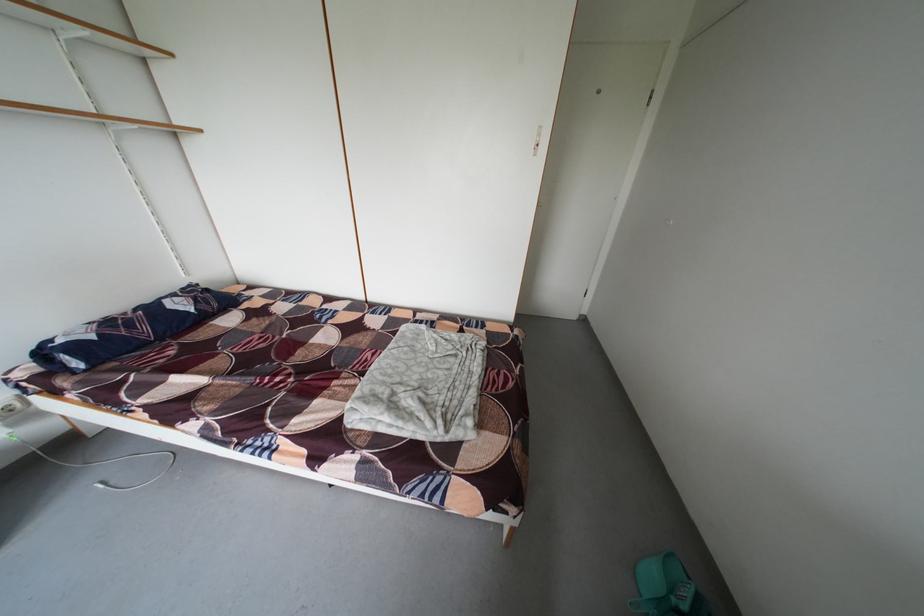
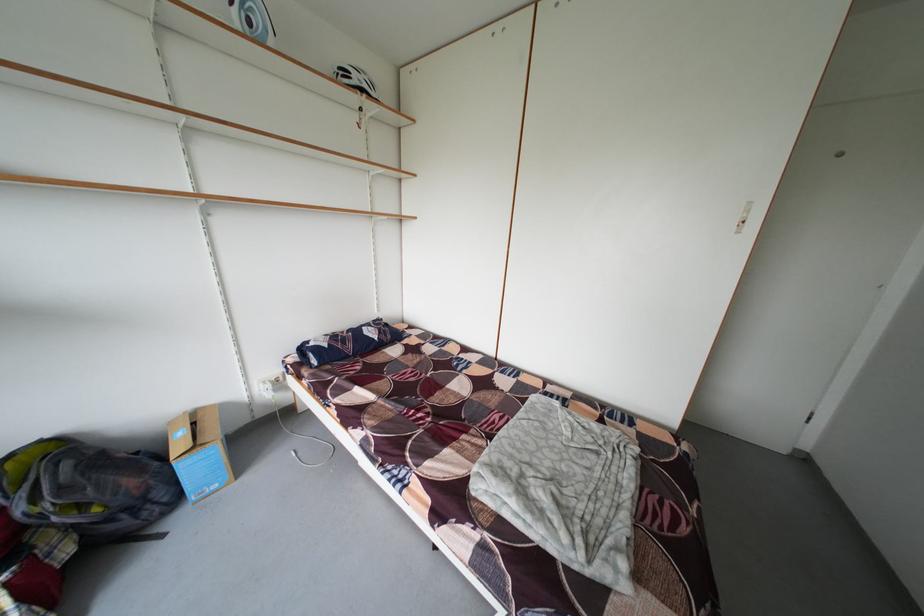
Find the pixel in the second image that matches point 380,360 in the first image.

(506, 422)